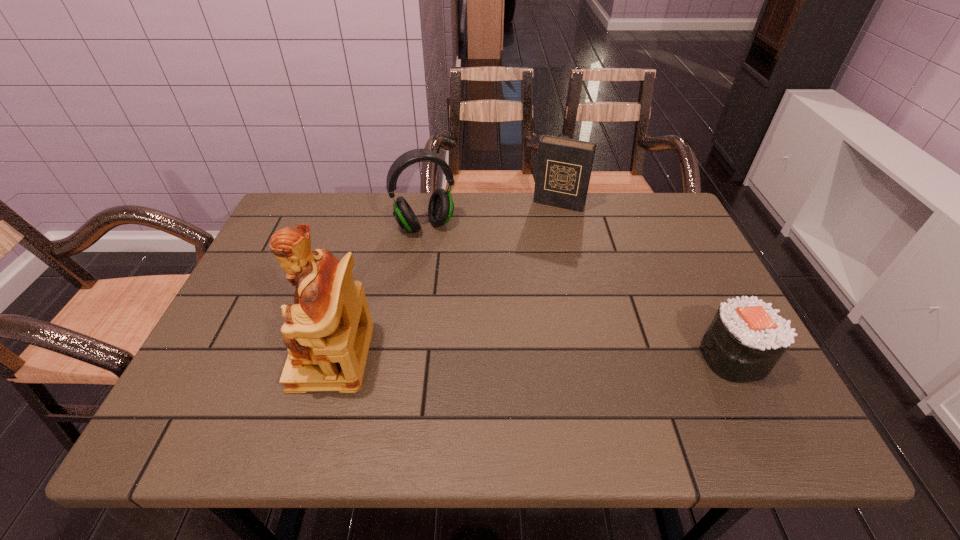
Identify the location of figurine. This screenshot has height=540, width=960. (328, 329).

Identify the location of sushi. This screenshot has width=960, height=540. (746, 338).

Locate an element on the screen. the shortest object is located at coordinates click(746, 338).

You are a GUI agent. You are given a task and a screenshot of the screen. Output one action in this format:
    pyautogui.click(x=<x>, y=<y>)
    Task: Click on the headset
    
    Given the screenshot: What is the action you would take?
    pyautogui.click(x=440, y=209)

The width and height of the screenshot is (960, 540). What are the coordinates of `diary` in the screenshot? It's located at (564, 166).

Locate an element on the screen. This screenshot has height=540, width=960. vacant point located on the front-facing side of the tallest object is located at coordinates (208, 356).

Where is `free space located on the front-facing side of the tallest object`? The height and width of the screenshot is (540, 960). free space located on the front-facing side of the tallest object is located at coordinates coord(254,356).

Find the location of `vacant area located 0.070m on the front-facing side of the tallest object`. vacant area located 0.070m on the front-facing side of the tallest object is located at coordinates (264, 356).

At what (x,y) coordinates should I click in order to perform the action: click on vacant space located 0.070m on the back of the shortest object. Please return your answer as a coordinate pair (x, y). The image size is (960, 540). Looking at the image, I should click on (709, 309).

Identify the location of free space located on the ear cups of the headset. (463, 297).